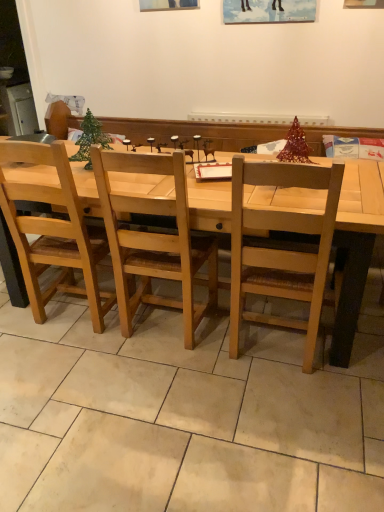
Find the location of a particular element. This screenshot has height=512, width=384. vacant space in between light brown wood chair at center, the second chair positioned from the right, and natural wood table at center is located at coordinates (137, 345).